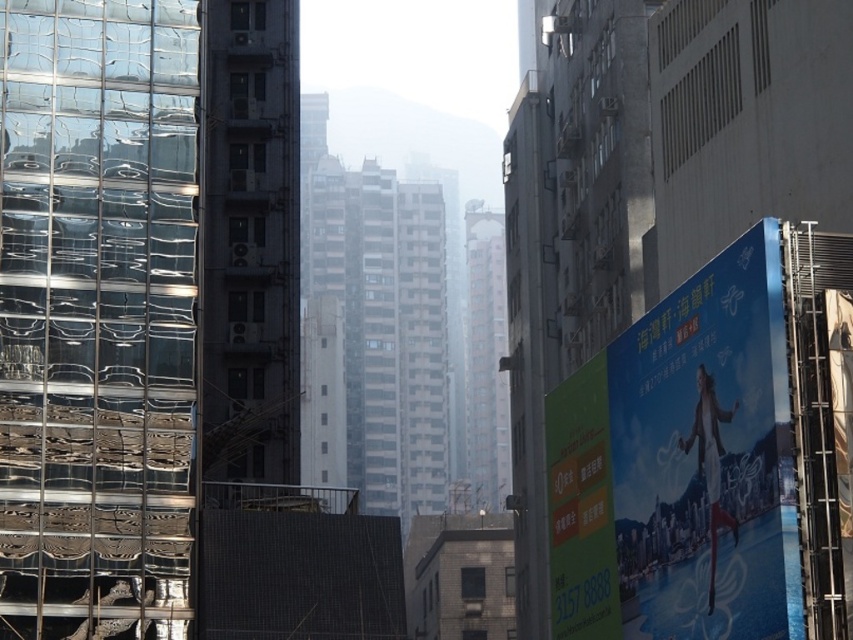
Question: Which object is closer to the camera taking this photo?

Choices:
 (A) blue glossy billboard at right
 (B) green matte signboard at right

Answer: (A)

Question: Among these points, which one is nearest to the camera?

Choices:
 (A) tap(138, 614)
 (B) tap(582, 465)

Answer: (A)

Question: Can you confirm if transparent glass scaffolding at left is wider than green matte signboard at right?

Choices:
 (A) yes
 (B) no

Answer: (A)

Question: Is the position of blue glossy billboard at right less distant than that of green matte signboard at right?

Choices:
 (A) no
 (B) yes

Answer: (B)

Question: Is the position of transparent glass scaffolding at left less distant than that of blue glossy billboard at right?

Choices:
 (A) no
 (B) yes

Answer: (A)

Question: Which object is positioned closest to the green matte signboard at right?

Choices:
 (A) transparent glass scaffolding at left
 (B) blue glossy billboard at right

Answer: (B)